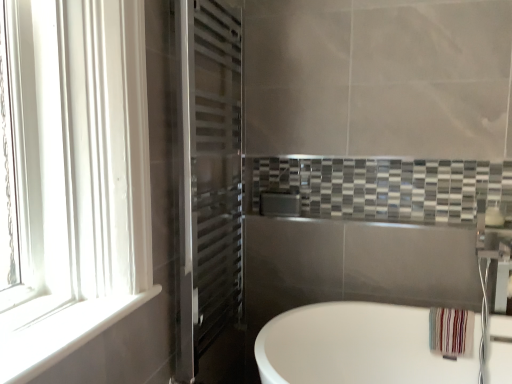
Question: Considering their positions, is polished stainless steel towel rack at left located in front of or behind white smooth window sill at left?

Choices:
 (A) front
 (B) behind

Answer: (B)

Question: Considering the positions of polished stainless steel towel rack at left and white smooth window sill at left in the image, is polished stainless steel towel rack at left bigger or smaller than white smooth window sill at left?

Choices:
 (A) big
 (B) small

Answer: (A)

Question: Considering the real-world distances, which object is farthest from the striped fabric towel at lower right?

Choices:
 (A) white smooth window sill at left
 (B) polished stainless steel towel rack at left
 (C) white glossy bathtub at lower right

Answer: (A)

Question: Estimate the real-world distances between objects in this image. Which object is farther from the polished stainless steel towel rack at left?

Choices:
 (A) striped fabric towel at lower right
 (B) white glossy bathtub at lower right
 (C) white smooth window sill at left

Answer: (A)